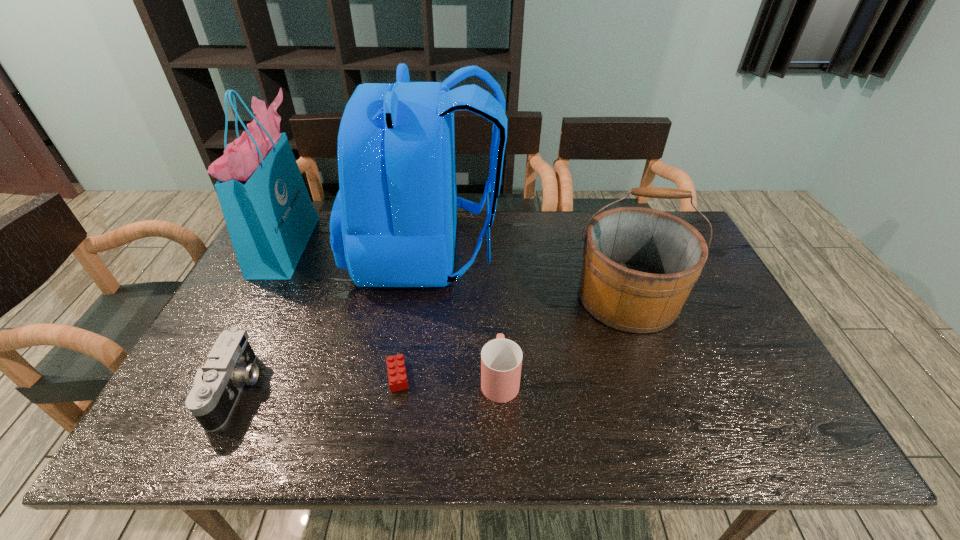
Identify the location of free region that satisfies the following two spatial constraints: 1. on the side of the cup with the handle; 2. on the back of the backpack. The height and width of the screenshot is (540, 960). (494, 252).